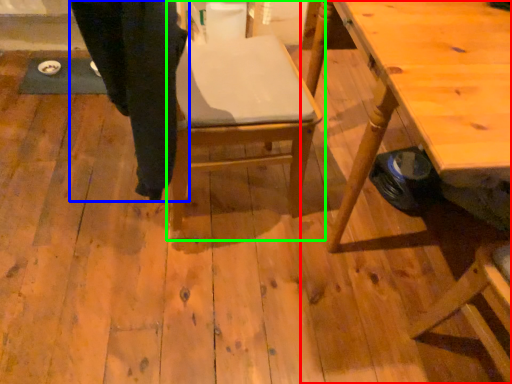
Question: Which object is the farthest from table (highlighted by a red box)? Choose among these: trousers (highlighted by a blue box) or chair (highlighted by a green box).

Choices:
 (A) trousers
 (B) chair

Answer: (A)